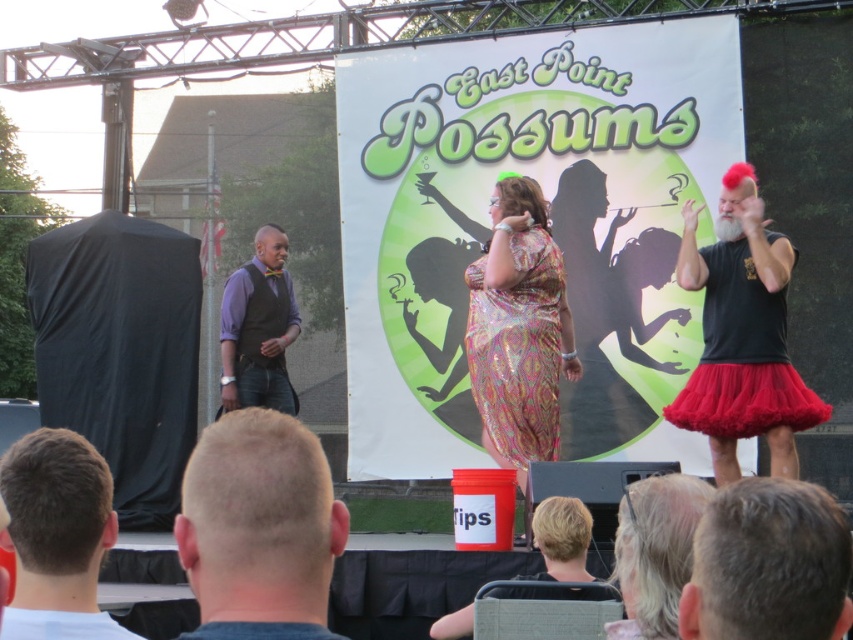
Question: Which object is closer to the camera taking this photo?

Choices:
 (A) printed silk dress at center
 (B) purple satin vest at center

Answer: (A)

Question: Which of these objects is positioned closest to the gray hair at upper center?

Choices:
 (A) brown hair at center
 (B) blonde hair at center

Answer: (B)

Question: Is matte black tutu at right further to the viewer compared to short hair at center?

Choices:
 (A) no
 (B) yes

Answer: (B)

Question: Which of these objects is positioned closest to the purple satin vest at center?

Choices:
 (A) brown hair at center
 (B) black fabric shirt at lower center
 (C) gray hair at upper center

Answer: (A)

Question: Does printed silk dress at center appear on the right side of gray hair at upper center?

Choices:
 (A) no
 (B) yes

Answer: (A)

Question: Does blonde hair at center have a smaller size compared to brown hair at center?

Choices:
 (A) no
 (B) yes

Answer: (A)